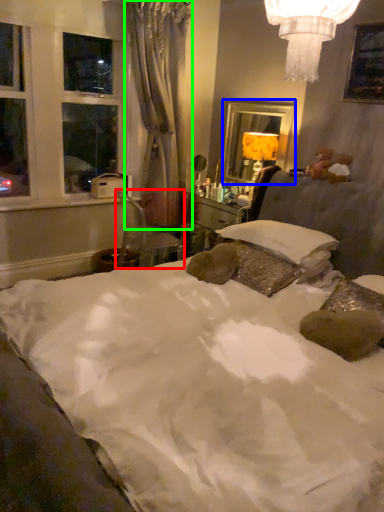
Question: Estimate the real-world distances between objects in this image. Which object is farther from chair (highlighted by a red box), mirror (highlighted by a blue box) or curtain (highlighted by a green box)?

Choices:
 (A) mirror
 (B) curtain

Answer: (A)